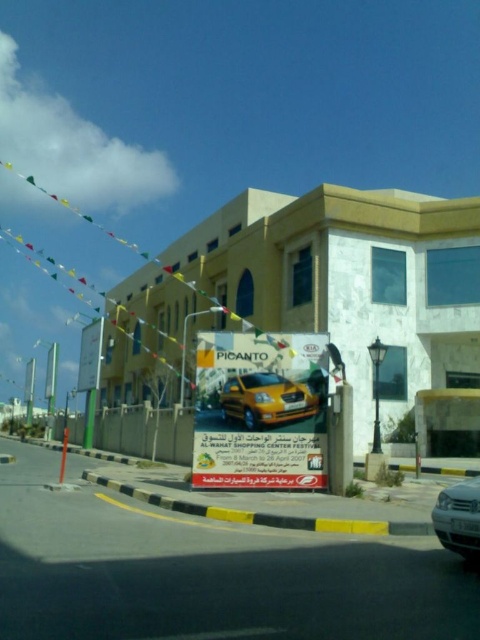
In the scene shown: Is yellow glossy car at center taller than yellow matte car at center?

Yes.

Which is above, yellow glossy car at center or yellow matte car at center?

yellow matte car at center is higher up.

Locate an element on the screen. yellow glossy car at center is located at coordinates (261, 410).

Locate an element on the screen. The image size is (480, 640). yellow glossy car at center is located at coordinates (261, 410).

Is yellow matte car at center taller than silver metallic car at lower right?

Indeed, yellow matte car at center has a greater height compared to silver metallic car at lower right.

Can you confirm if yellow matte car at center is positioned to the left of silver metallic car at lower right?

Correct, you'll find yellow matte car at center to the left of silver metallic car at lower right.

Where is `yellow matte car at center`? This screenshot has width=480, height=640. yellow matte car at center is located at coordinates (266, 400).

Find the location of a particular element. yellow matte car at center is located at coordinates (266, 400).

Is point (240, 371) farther from camera compared to point (443, 497)?

That is True.

Does yellow glossy car at center have a larger size compared to silver metallic car at lower right?

Yes, yellow glossy car at center is bigger than silver metallic car at lower right.

Is point (255, 464) farther from viewer compared to point (458, 532)?

Yes, point (255, 464) is farther from viewer.

You are a GUI agent. You are given a task and a screenshot of the screen. Output one action in this format:
    pyautogui.click(x=<x>, y=<y>)
    Task: Click on the yellow glossy car at center
    Image resolution: width=480 pixels, height=640 pixels.
    Given the screenshot: What is the action you would take?
    pyautogui.click(x=261, y=410)